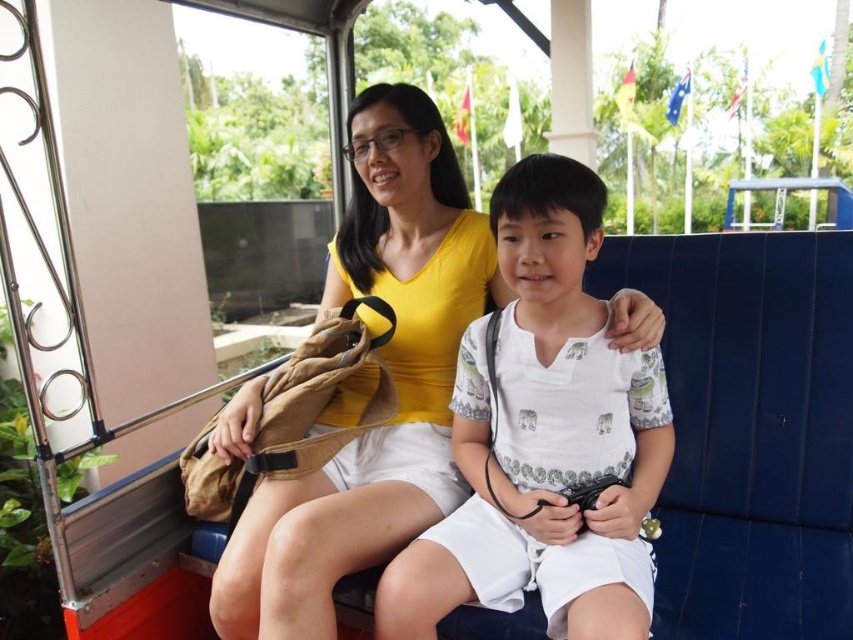
Consider the image. Is white cotton shirt at center taller than yellow matte shirt at center?

No.

How much distance is there between white cotton shirt at center and yellow matte shirt at center?

10.16 inches

Which is behind, point (590, 202) or point (323, 531)?

The point (590, 202) is behind.

The height and width of the screenshot is (640, 853). I want to click on white cotton shirt at center, so click(544, 438).